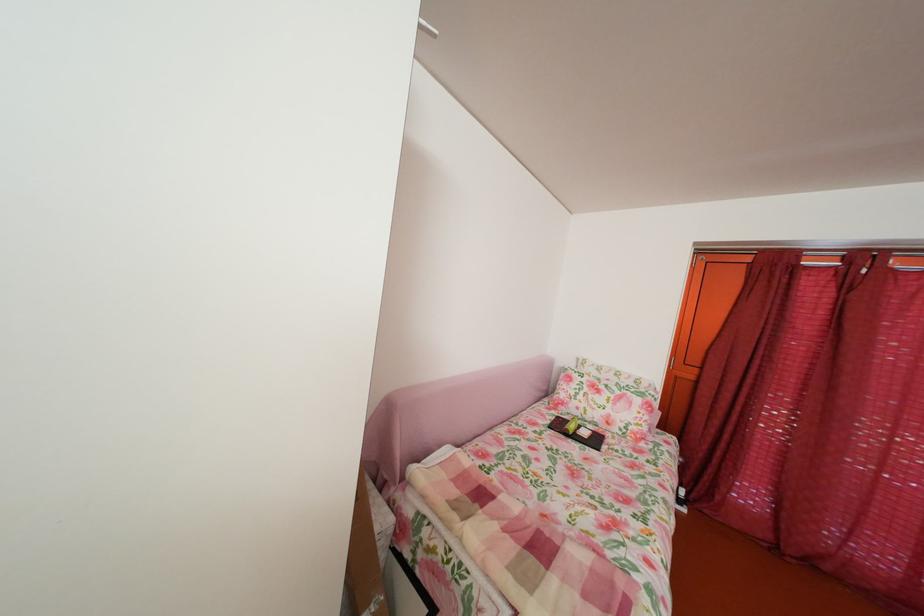
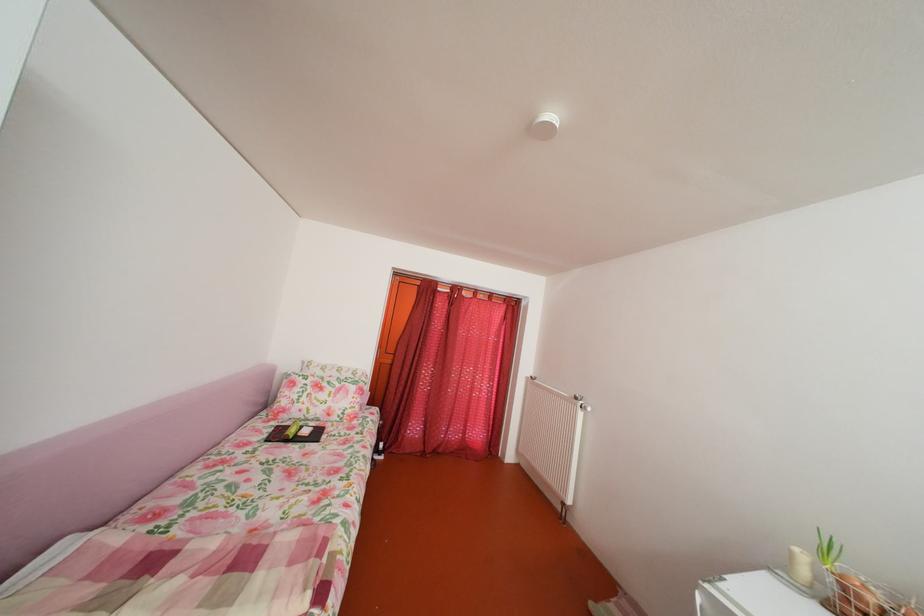
Where in the second image is the point corresponding to (x=582, y=434) from the first image?

(304, 438)